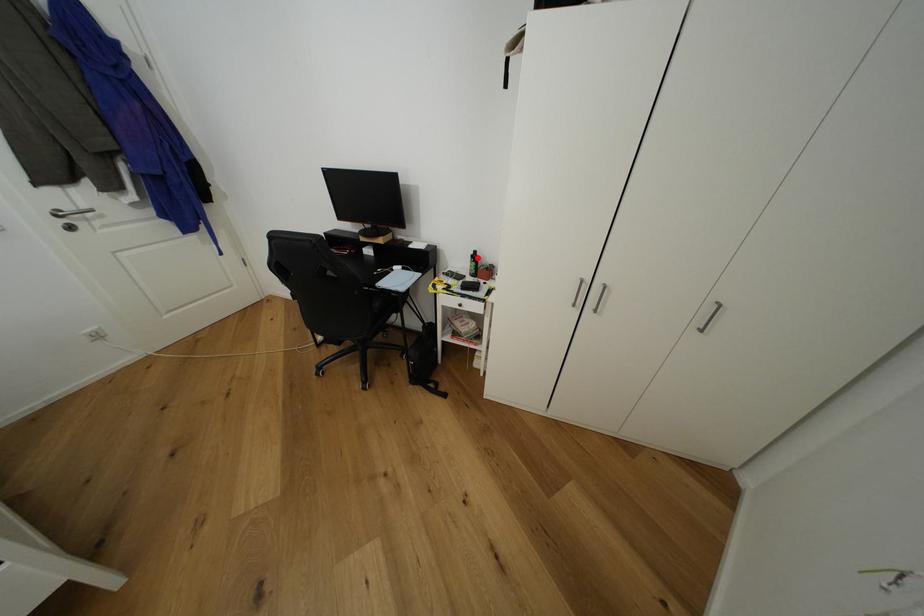
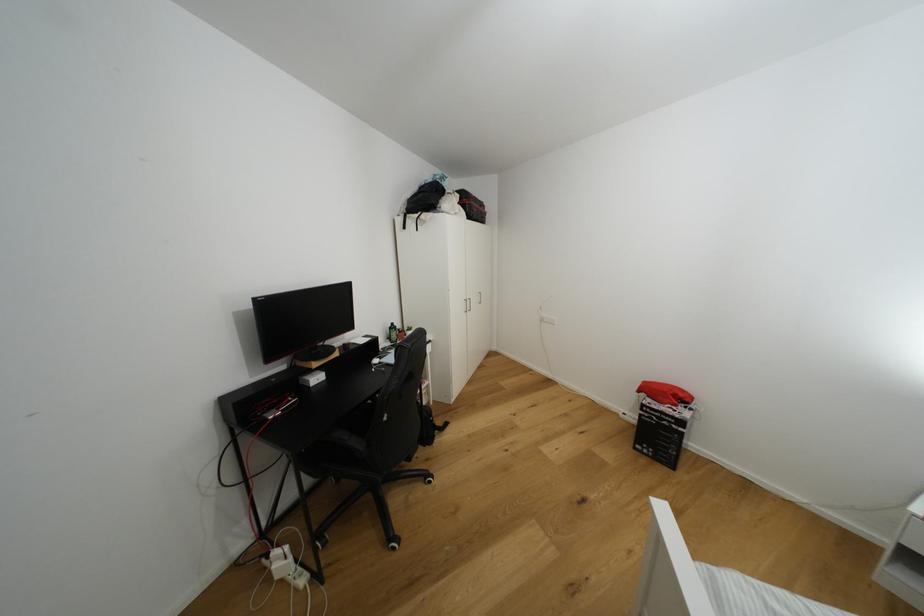
Question: I am providing you with two images of the same scene from different viewpoints. Image1 has a red point marked. In image2, the corresponding 3D location appears at what relative position? Reply with the corresponding letter.

Choices:
 (A) Closer
 (B) Farther

Answer: (B)